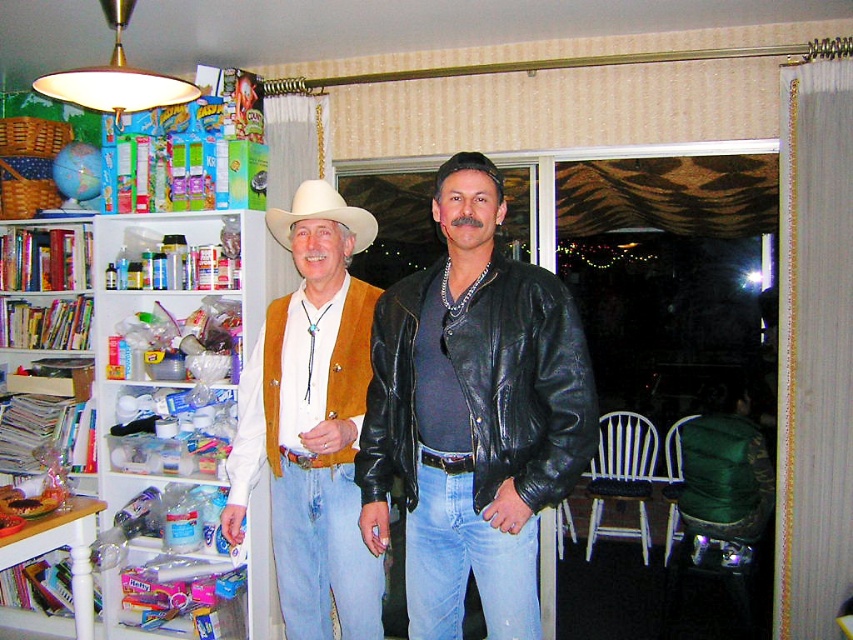
Question: Which point appears closest to the camera in this image?

Choices:
 (A) (405, 516)
 (B) (496, 285)
 (C) (343, 618)

Answer: (B)

Question: Which object appears farthest from the camera in this image?

Choices:
 (A) white matte cowboy hat at center
 (B) white plastic bookshelf at left
 (C) matte brown vest at left

Answer: (B)

Question: Estimate the real-world distances between objects in this image. Which object is closer to the matte brown vest at left?

Choices:
 (A) black leather jacket at center
 (B) matte brown vest at center
 (C) white plastic bookshelf at left

Answer: (A)

Question: Does matte brown vest at left have a greater width compared to white matte cowboy hat at center?

Choices:
 (A) no
 (B) yes

Answer: (B)

Question: Can you confirm if black leather jacket at center is positioned below white plastic bookshelf at left?

Choices:
 (A) no
 (B) yes

Answer: (A)

Question: From the image, what is the correct spatial relationship of black leather jacket at center in relation to white matte cowboy hat at center?

Choices:
 (A) right
 (B) left

Answer: (A)